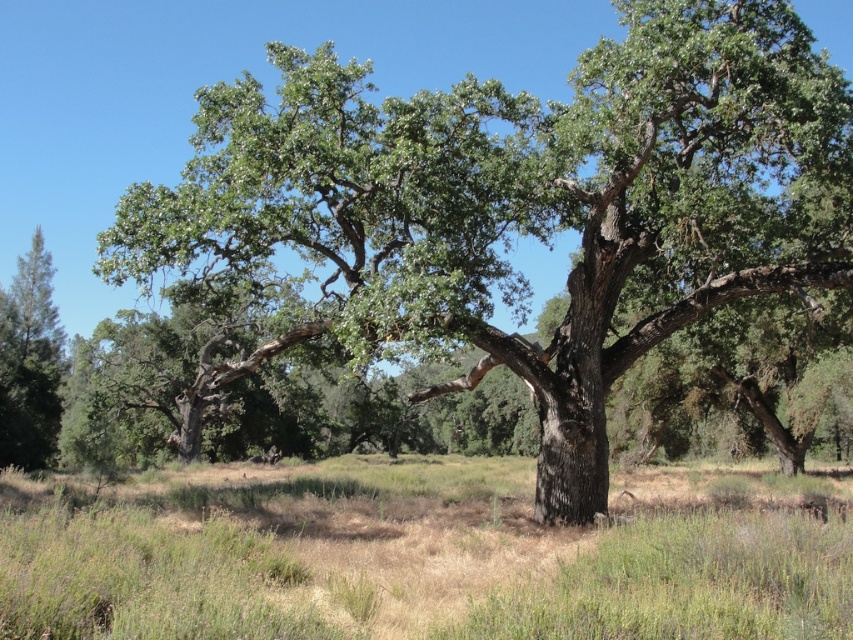
Question: From the image, what is the correct spatial relationship of green rough bark tree at center in relation to green grass at center?

Choices:
 (A) above
 (B) below

Answer: (A)

Question: Does green rough bark tree at center come behind green grass at center?

Choices:
 (A) yes
 (B) no

Answer: (A)

Question: Is green rough bark tree at center to the right of green grass at center from the viewer's perspective?

Choices:
 (A) no
 (B) yes

Answer: (A)

Question: Which point is closer to the camera?

Choices:
 (A) (32, 499)
 (B) (589, 372)

Answer: (B)

Question: Among these points, which one is farthest from the camera?

Choices:
 (A) (541, 628)
 (B) (628, 275)

Answer: (B)

Question: Which point appears closest to the camera in this image?

Choices:
 (A) (598, 381)
 (B) (192, 556)

Answer: (B)